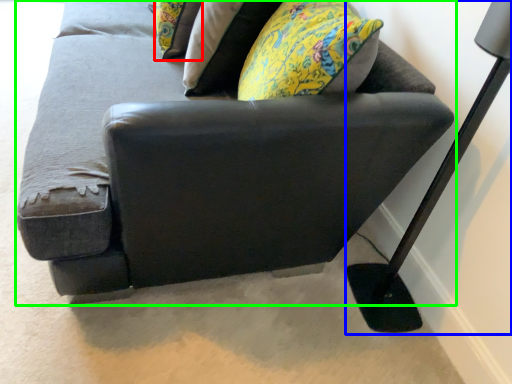
Question: Estimate the real-world distances between objects in this image. Which object is closer to pillow (highlighted by a red box), table lamp (highlighted by a blue box) or studio couch (highlighted by a green box)?

Choices:
 (A) table lamp
 (B) studio couch

Answer: (B)